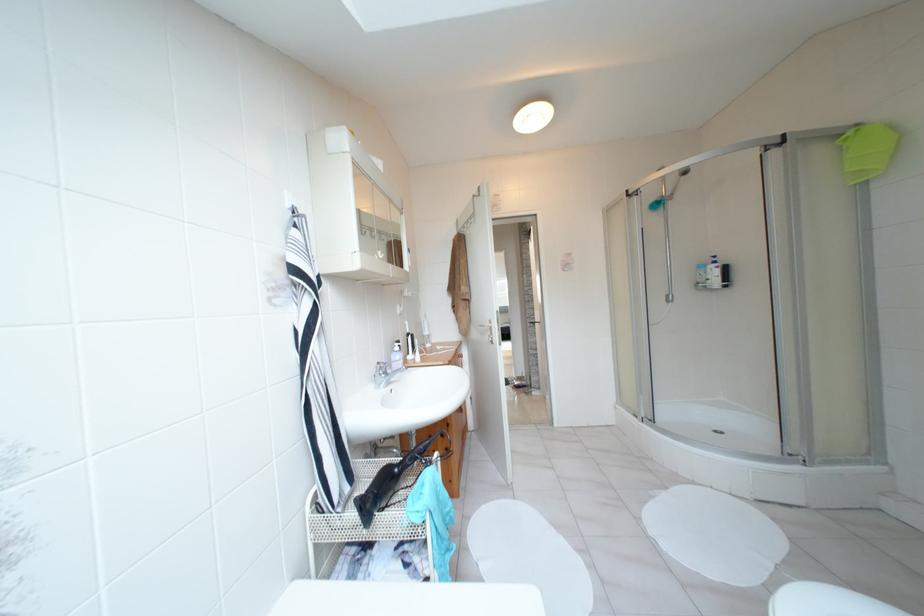
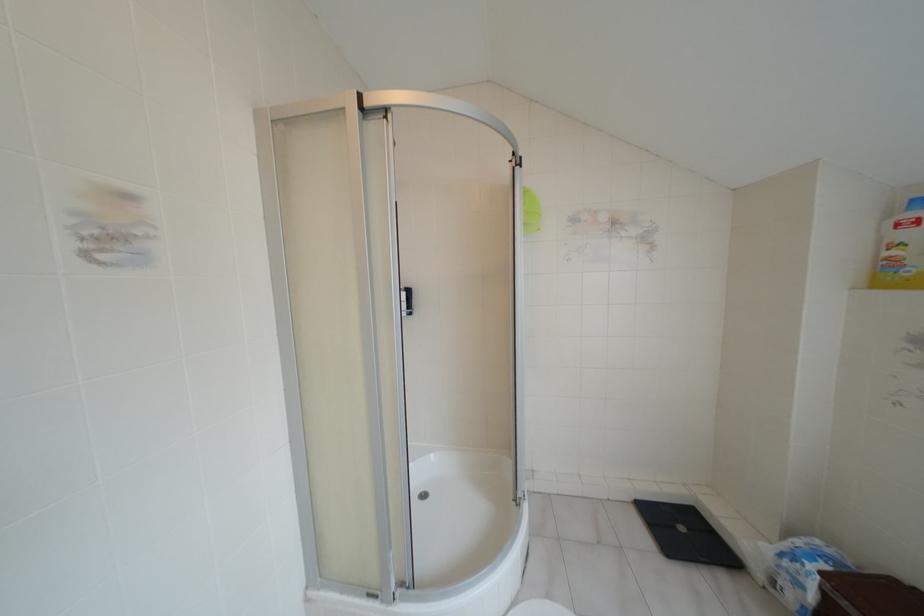
In the second image, find the point that corresponds to pixel 724 268 in the first image.

(407, 292)